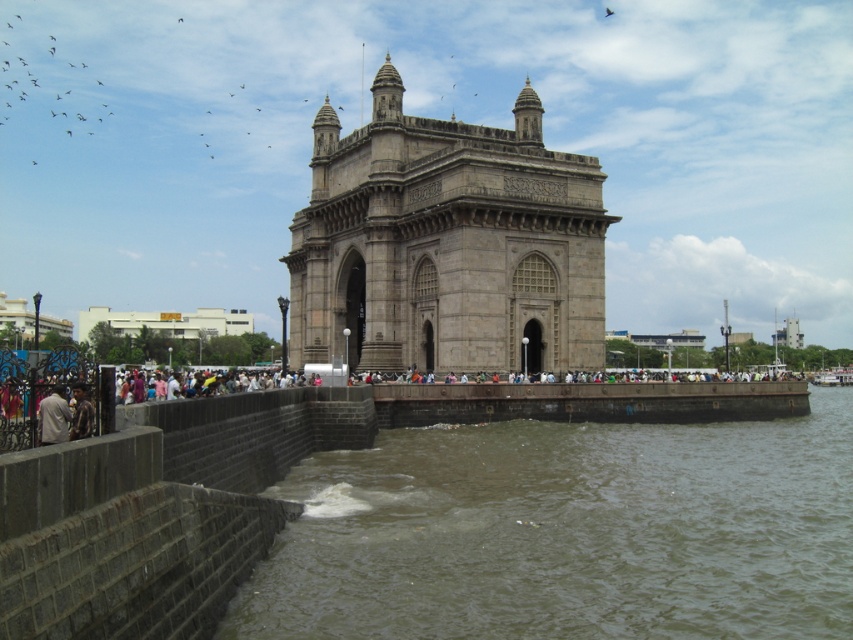
Question: Does light brown fabric jacket at lower left come behind dark brown leather jacket at lower left?

Choices:
 (A) yes
 (B) no

Answer: (B)

Question: Does brown concrete river at lower center come in front of gray stone gateway of india at center?

Choices:
 (A) yes
 (B) no

Answer: (A)

Question: Which object appears farthest from the camera in this image?

Choices:
 (A) dark brown leather jacket at lower left
 (B) gray stone gateway of india at center
 (C) brown concrete river at lower center
 (D) light brown fabric jacket at lower left

Answer: (B)

Question: Which of the following is the closest to the observer?

Choices:
 (A) light brown fabric jacket at lower left
 (B) dark brown leather jacket at lower left
 (C) gray stone gateway of india at center
 (D) brown concrete river at lower center

Answer: (D)

Question: Can you confirm if gray stone gateway of india at center is wider than light brown fabric jacket at lower left?

Choices:
 (A) no
 (B) yes

Answer: (B)

Question: Which of the following is the closest to the observer?

Choices:
 (A) (61, 413)
 (B) (508, 589)
 (C) (376, 362)
 (D) (80, 432)

Answer: (A)